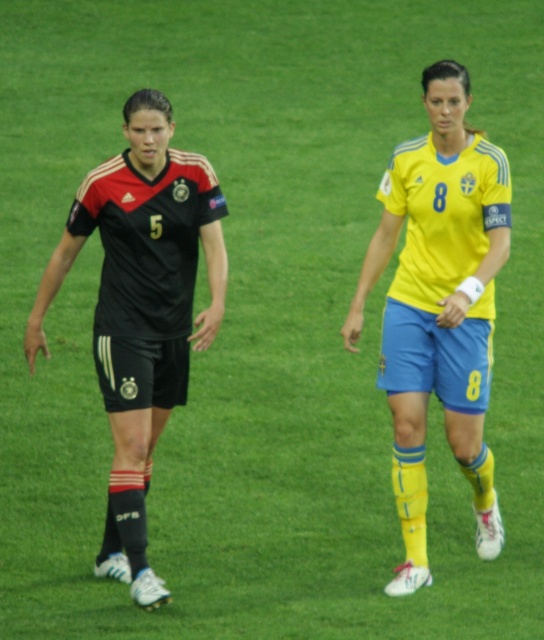
Question: Can you confirm if yellow matte jersey at center is wider than matte black jersey at left?

Choices:
 (A) yes
 (B) no

Answer: (B)

Question: Which of the following is the closest to the observer?

Choices:
 (A) matte black jersey at left
 (B) yellow matte jersey at center

Answer: (B)

Question: Which point appears farthest from the camera in this image?

Choices:
 (A) (157, 388)
 (B) (466, 451)

Answer: (A)

Question: Which point is closer to the camera?

Choices:
 (A) yellow matte jersey at center
 (B) matte black jersey at left

Answer: (A)

Question: Is yellow matte jersey at center closer to the viewer compared to matte black jersey at left?

Choices:
 (A) no
 (B) yes

Answer: (B)

Question: Can you confirm if yellow matte jersey at center is wider than matte black jersey at left?

Choices:
 (A) no
 (B) yes

Answer: (A)